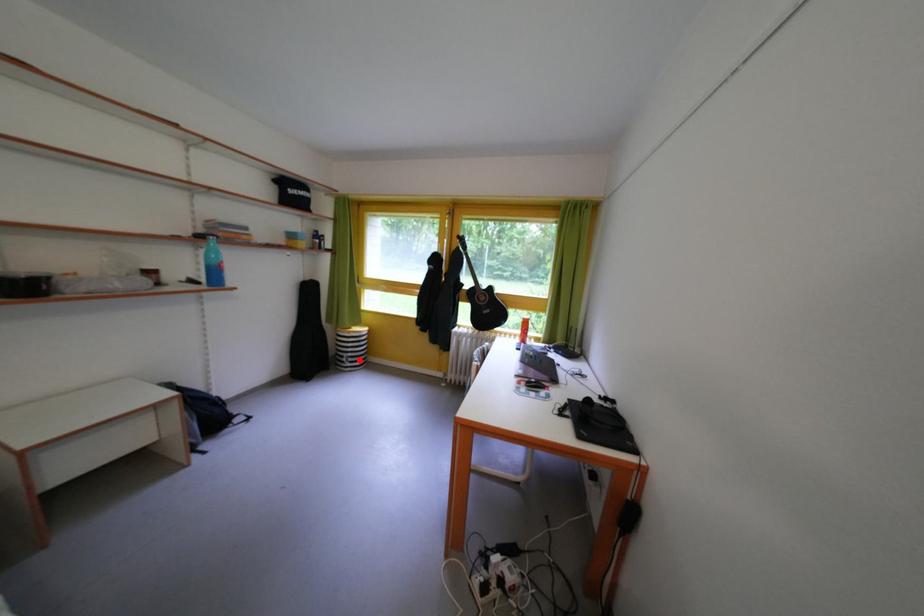
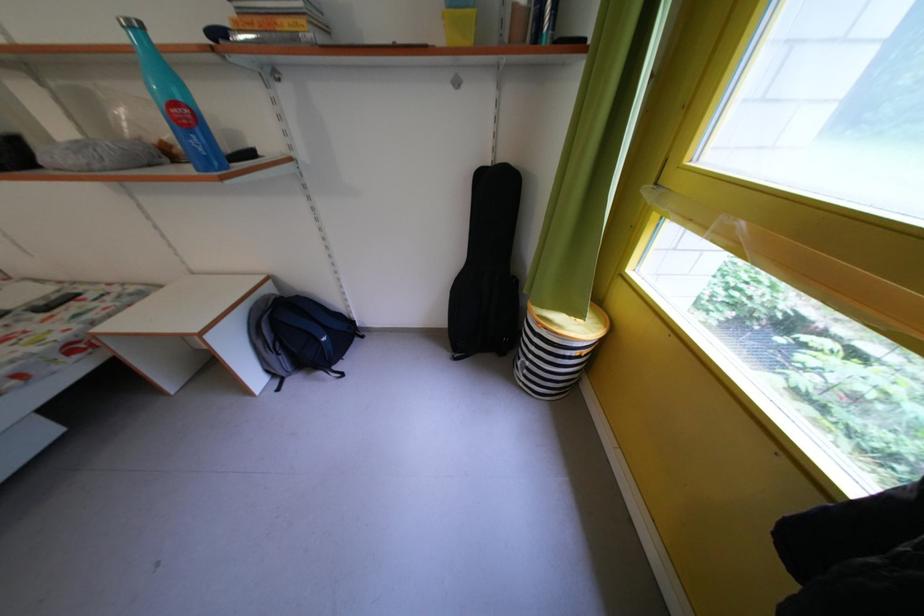
Question: I am providing you with two images of the same scene from different viewpoints. A red point is shown in image1. For the corresponding object point in image2, is it positioned nearer or farther from the camera?

Choices:
 (A) Nearer
 (B) Farther

Answer: (B)